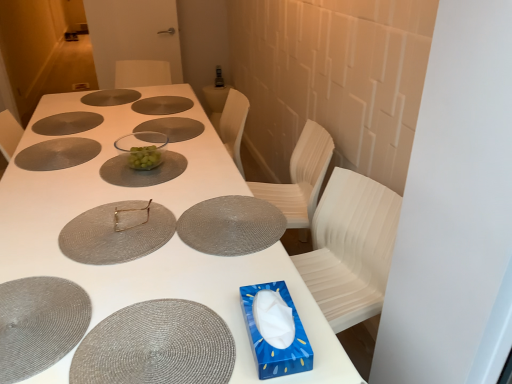
I want to click on free spot in front of transparent glass bowl at center, acting as the sixth glass plate starting from the back, so click(x=126, y=194).